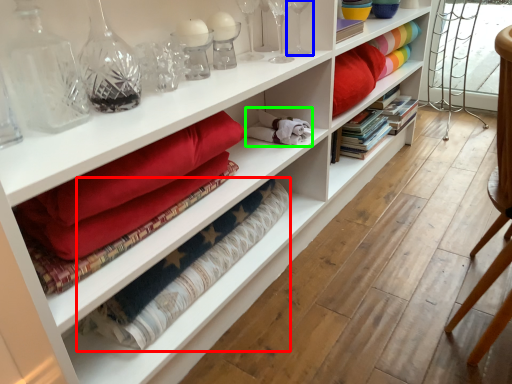
Question: Which object is positioned closest to material (highlighted by a red box)? Select from glass vase (highlighted by a blue box) and clothing (highlighted by a green box).

Choices:
 (A) glass vase
 (B) clothing

Answer: (B)